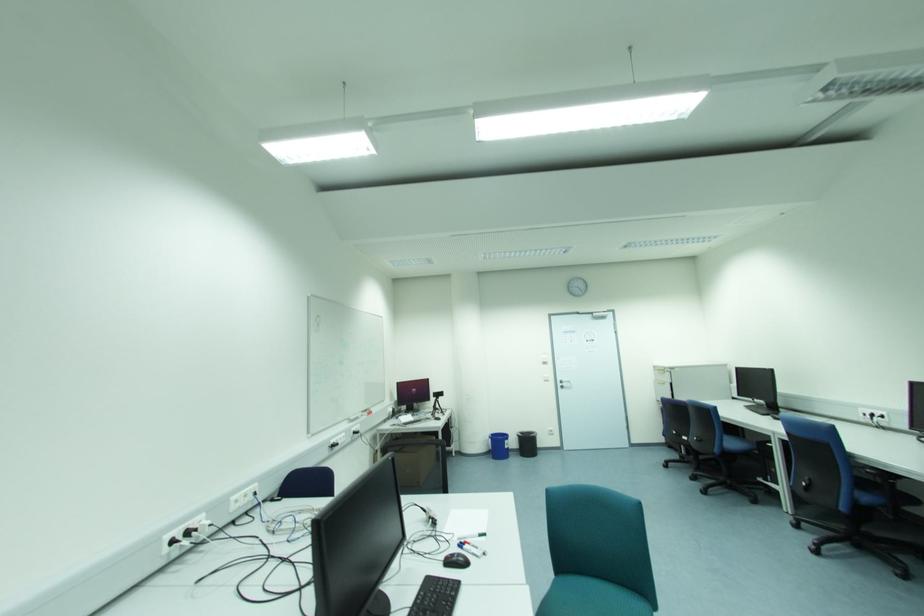
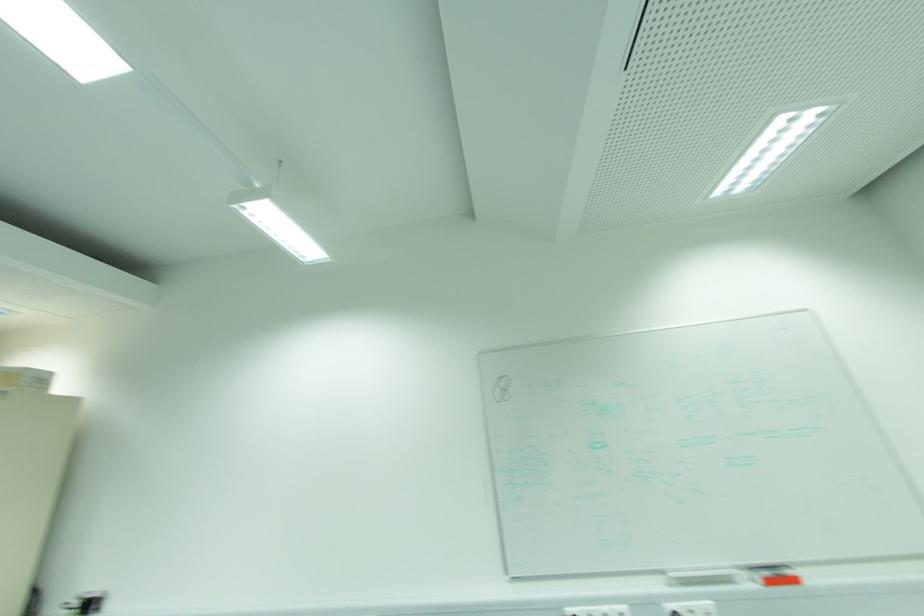
In the second image, find the point that corresponds to pixel 371 413 in the first image.

(796, 581)